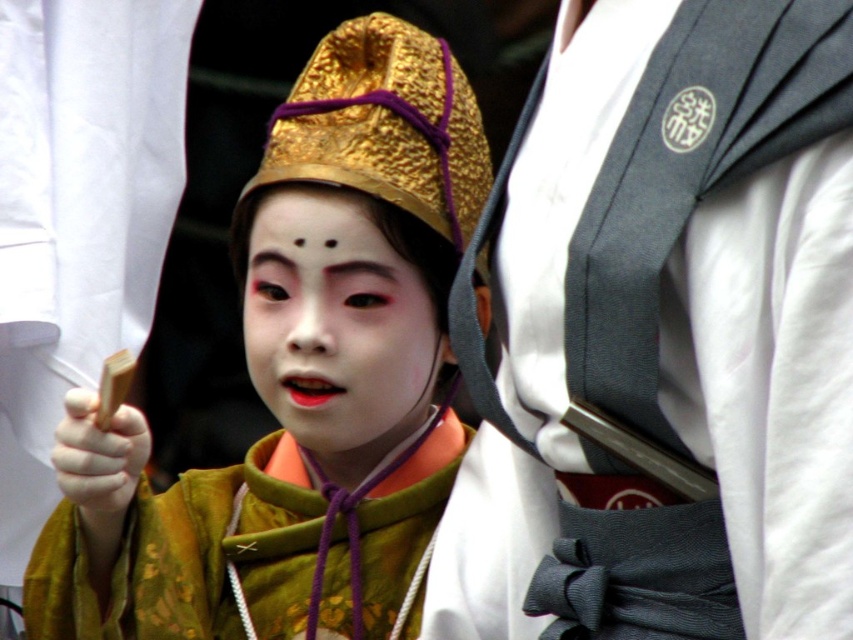
From the picture: Does silky white kimono at center appear on the right side of matte gold face at center?

Correct, you'll find silky white kimono at center to the right of matte gold face at center.

Who is positioned more to the left, silky white kimono at center or matte gold face at center?

matte gold face at center is more to the left.

Between point (476, 353) and point (387, 243), which one is positioned in front?

Point (476, 353) is more forward.

Where is `silky white kimono at center`? silky white kimono at center is located at coordinates (663, 333).

Image resolution: width=853 pixels, height=640 pixels. Describe the element at coordinates (300, 381) in the screenshot. I see `matte gold crown at center` at that location.

Does matte gold crown at center have a greater height compared to matte gold face at center?

Incorrect, matte gold crown at center's height is not larger of matte gold face at center's.

This screenshot has height=640, width=853. I want to click on matte gold crown at center, so click(x=300, y=381).

Does silky white kimono at center have a lesser width compared to matte gold crown at center?

In fact, silky white kimono at center might be wider than matte gold crown at center.

Is point (798, 51) closer to viewer compared to point (140, 442)?

Yes, point (798, 51) is in front of point (140, 442).

You are a GUI agent. You are given a task and a screenshot of the screen. Output one action in this format:
    pyautogui.click(x=<x>, y=<y>)
    Task: Click on the silky white kimono at center
    The height and width of the screenshot is (640, 853).
    Given the screenshot: What is the action you would take?
    pyautogui.click(x=663, y=333)

You are a GUI agent. You are given a task and a screenshot of the screen. Output one action in this format:
    pyautogui.click(x=<x>, y=<y>)
    Task: Click on the silky white kimono at center
    The image size is (853, 640).
    Given the screenshot: What is the action you would take?
    pyautogui.click(x=663, y=333)